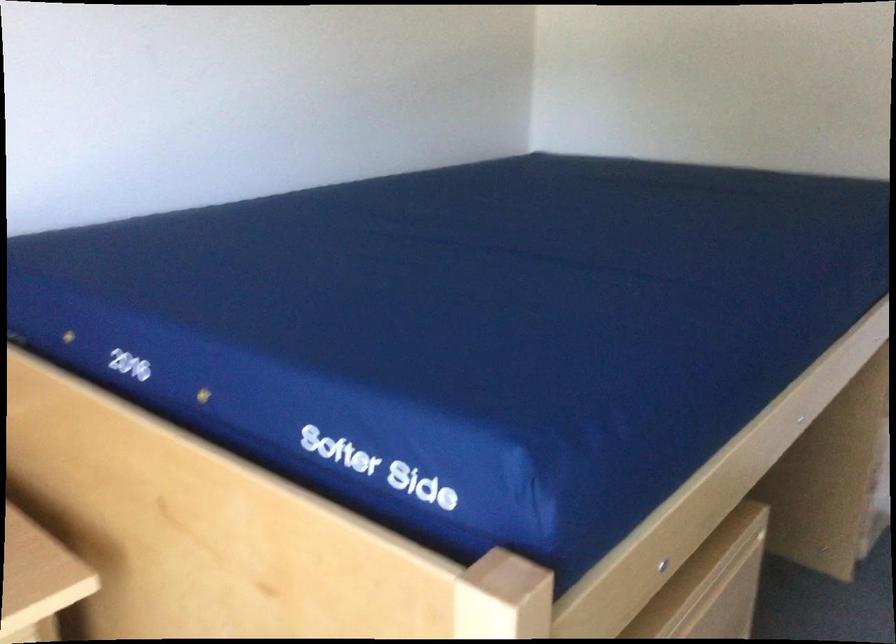
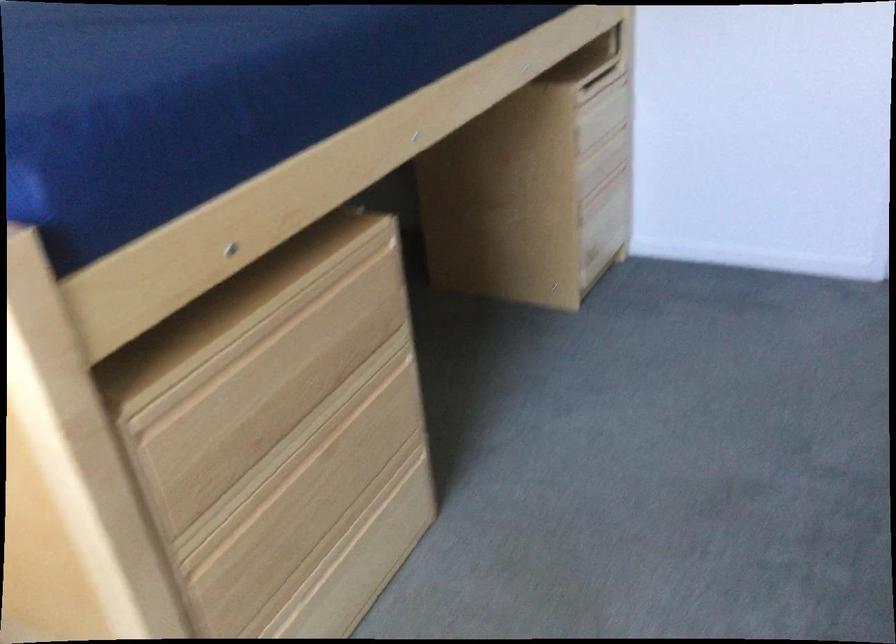
Question: How did the camera likely rotate?

Choices:
 (A) Left
 (B) Right
 (C) Up
 (D) Down

Answer: (D)